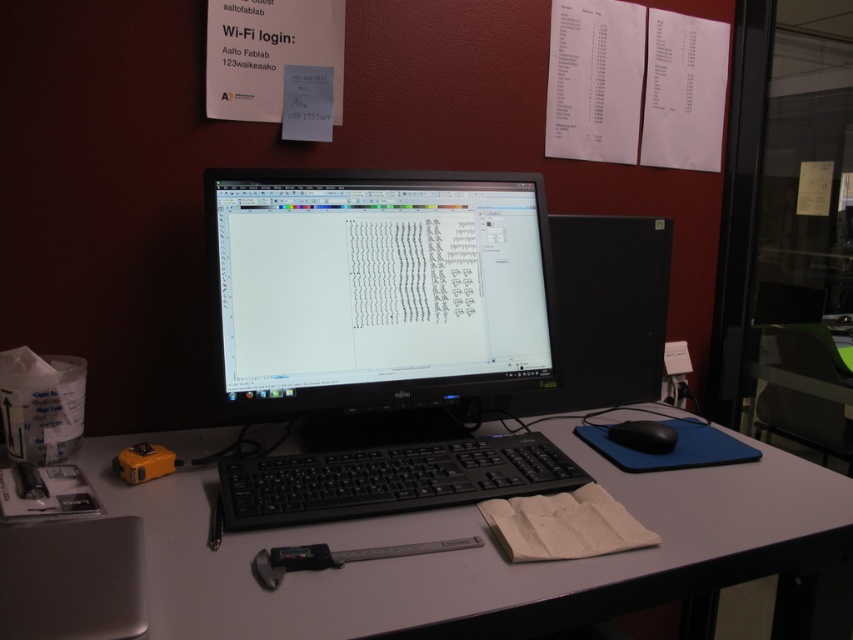
Question: Can you confirm if silver metallic caliper at center is positioned to the left of black matte mouse at lower right?

Choices:
 (A) no
 (B) yes

Answer: (B)

Question: Is gray matte computer desk at center in front of black matte computer monitor at right?

Choices:
 (A) no
 (B) yes

Answer: (B)

Question: Can you confirm if black matte computer monitor at right is smaller than black matte mouse at lower right?

Choices:
 (A) yes
 (B) no

Answer: (B)

Question: Which of the following is the farthest from the observer?

Choices:
 (A) gray matte computer desk at center
 (B) black matte mouse at lower right
 (C) black matte computer monitor at right
 (D) silver metallic caliper at center

Answer: (C)

Question: Which object is the farthest from the gray matte computer desk at center?

Choices:
 (A) black matte monitor at center
 (B) black matte mouse at lower right
 (C) black plastic keyboard at center

Answer: (B)

Question: Estimate the real-world distances between objects in this image. Which object is farther from the gray matte computer desk at center?

Choices:
 (A) black matte mouse at lower right
 (B) black matte monitor at center
 (C) black plastic keyboard at center
 (D) black matte computer monitor at right

Answer: (A)